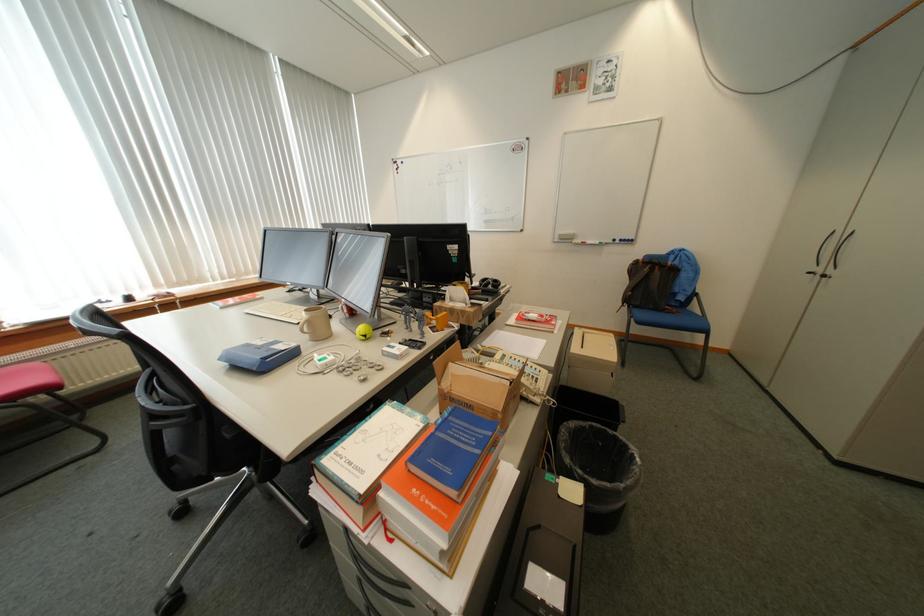
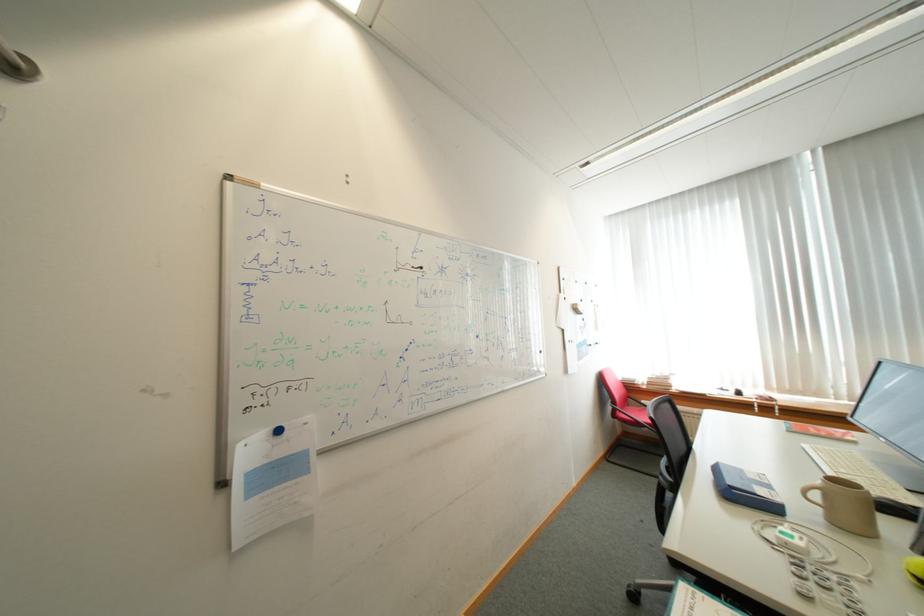
Question: The images are taken continuously from a first-person perspective. In which direction is your viewpoint rotating?

Choices:
 (A) Left
 (B) Right
 (C) Up
 (D) Down

Answer: (A)